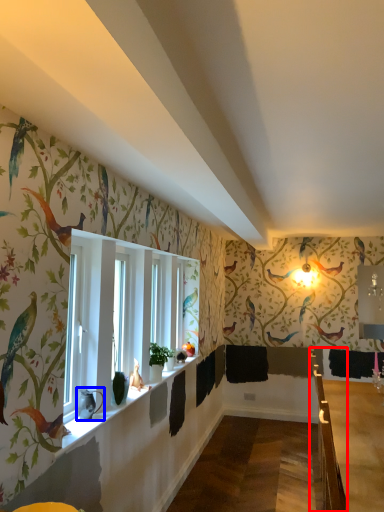
Question: Which object is further to the camera taking this photo, rail (highlighted by a red box) or animal (highlighted by a blue box)?

Choices:
 (A) rail
 (B) animal

Answer: (A)